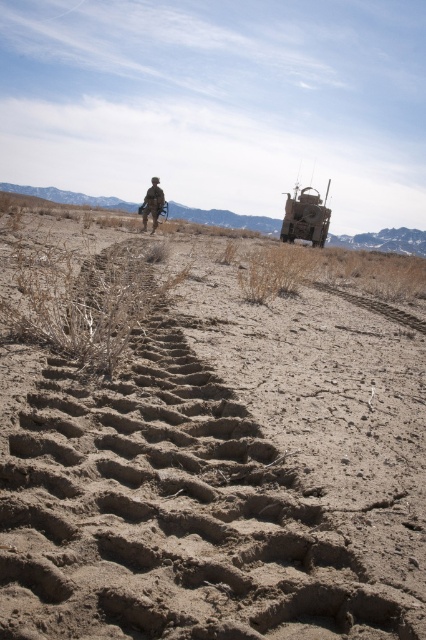
Based on the scene description, what object or feature is located at the coordinates point (218, 472)?

The coordinates point (218, 472) corresponds to dull brown dirt at center.

You are navigating a desert terrain and need to reach a checkpoint located at point (287, 524). You are currently at point (316, 202). Based on the image, which direction should you move to reach the checkpoint?

You should move forward because point (287, 524) is in front of point (316, 202).

You are a desert explorer who needs to cross the dull brown dirt at center. There is a camouflage fabric military vehicle at upper center nearby. Which one is taller? Please answer based on the scene description.

The dull brown dirt at center is not as tall as the camouflage fabric military vehicle at upper center, so the camouflage fabric military vehicle at upper center is taller.